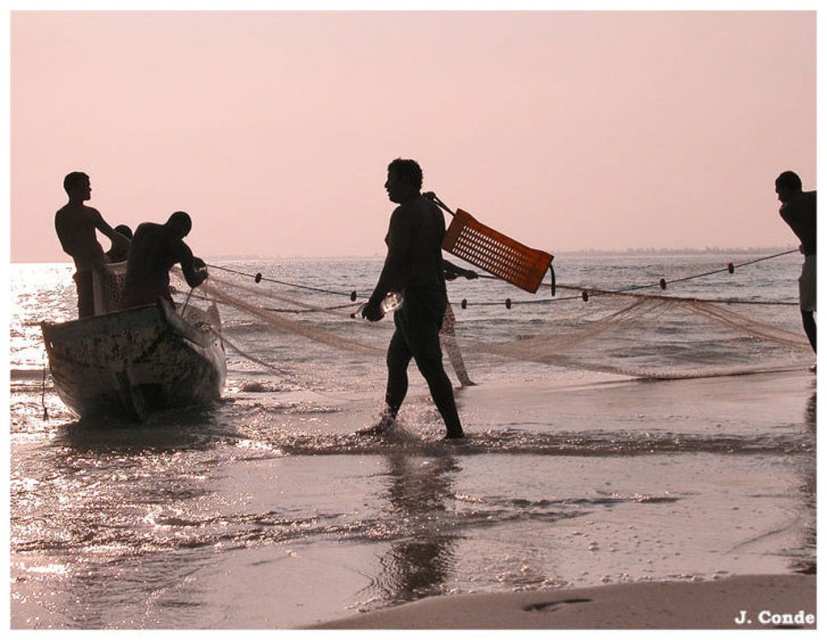
Is dark matte wicker basket at center further to camera compared to smooth skin man at right?

No, dark matte wicker basket at center is in front of smooth skin man at right.

Who is more forward, (x=423, y=292) or (x=813, y=262)?

Positioned in front is point (x=423, y=292).

You are a GUI agent. You are given a task and a screenshot of the screen. Output one action in this format:
    pyautogui.click(x=<x>, y=<y>)
    Task: Click on the dark matte wicker basket at center
    The width and height of the screenshot is (827, 640).
    Given the screenshot: What is the action you would take?
    pyautogui.click(x=414, y=294)

I want to click on dark matte wicker basket at center, so click(414, 294).

Is smooth sand at lower center behind smooth skin man at right?

No.

Which is above, smooth sand at lower center or smooth skin man at right?

smooth skin man at right is above.

Does point (491, 620) come farther from viewer compared to point (805, 321)?

No, (491, 620) is closer to viewer.

Find the location of a particular element. The image size is (827, 640). smooth sand at lower center is located at coordinates (612, 605).

Does rusty metal boat at lower left have a lesser width compared to smooth skin man at right?

No.

Who is more distant from viewer, (75, 412) or (778, 204)?

Positioned behind is point (778, 204).

Measure the distance between rusty metal boat at lower left and camera.

A distance of 41.56 feet exists between rusty metal boat at lower left and camera.

Find the location of a particular element. The image size is (827, 640). rusty metal boat at lower left is located at coordinates (136, 362).